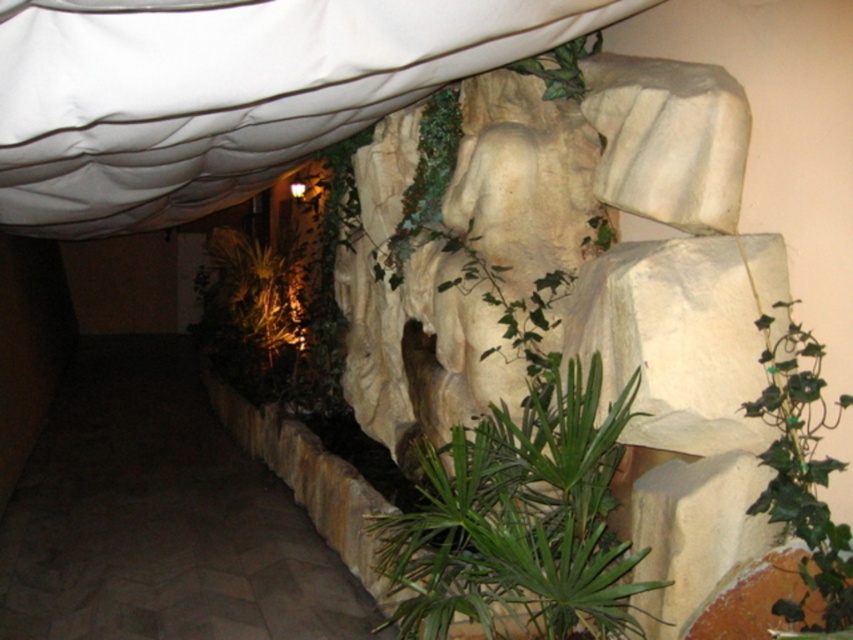
Question: In this image, where is brown stone pathway at lower left located relative to green leafy plant at center?

Choices:
 (A) right
 (B) left

Answer: (B)

Question: Estimate the real-world distances between objects in this image. Which object is closer to the green leafy plant at center?

Choices:
 (A) green leafy ivy at upper right
 (B) brown stone pathway at lower left

Answer: (A)

Question: Which point appears closest to the camera in this image?

Choices:
 (A) (799, 476)
 (B) (68, 458)

Answer: (A)

Question: Which object is positioned closest to the brown stone pathway at lower left?

Choices:
 (A) green leafy plant at center
 (B) green ivy at center
 (C) green leafy ivy at upper right

Answer: (B)

Question: Is green leafy plant at center thinner than green leafy ivy at upper right?

Choices:
 (A) no
 (B) yes

Answer: (A)

Question: Does brown stone pathway at lower left have a smaller size compared to green leafy plant at center?

Choices:
 (A) no
 (B) yes

Answer: (B)